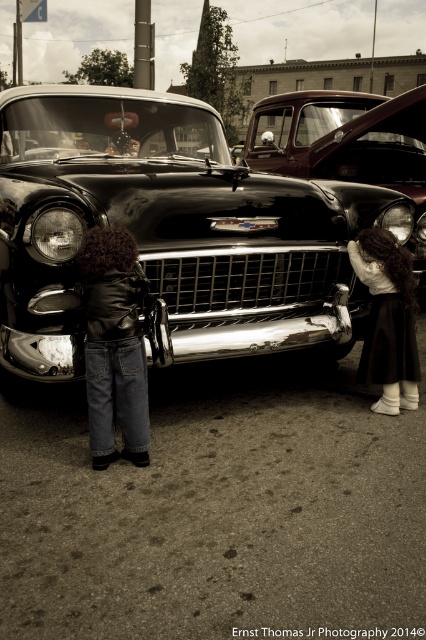
How far apart are shiny black car at center and shiny chrome pickup truck at center?

shiny black car at center and shiny chrome pickup truck at center are 3.47 meters apart from each other.

Measure the distance between point (267, 268) and camera.

Point (267, 268) is 3.88 meters away from camera.

Identify the location of shiny black car at center. (x=170, y=232).

This screenshot has width=426, height=640. In order to click on shiny black car at center in this screenshot , I will do `click(170, 232)`.

Which is below, leather jacket at center or white cotton blouse at lower right?

leather jacket at center

Between leather jacket at center and white cotton blouse at lower right, which one has less height?

white cotton blouse at lower right

Find the location of a particular element. The image size is (426, 640). leather jacket at center is located at coordinates (114, 346).

Consider the image. Who is positioned more to the right, shiny black car at center or white cotton blouse at lower right?

Positioned to the right is white cotton blouse at lower right.

Is shiny black car at center shorter than white cotton blouse at lower right?

In fact, shiny black car at center may be taller than white cotton blouse at lower right.

Is point (215, 192) in front of point (388, 285)?

Yes, it is.

The width and height of the screenshot is (426, 640). What are the coordinates of `shiny black car at center` in the screenshot? It's located at (170, 232).